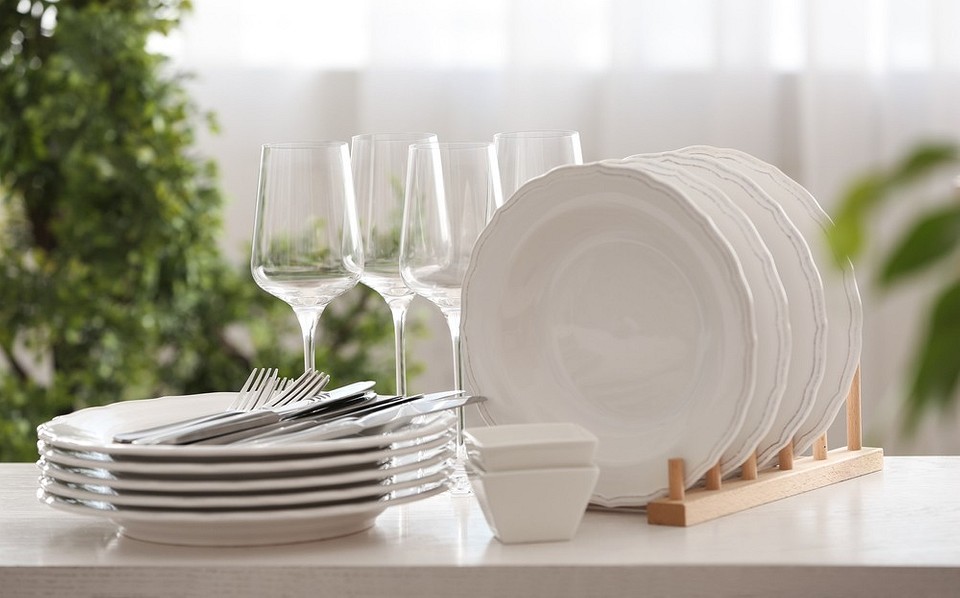
Identify the location of forks. This screenshot has width=960, height=598. (237, 396), (279, 382), (286, 398), (328, 382).